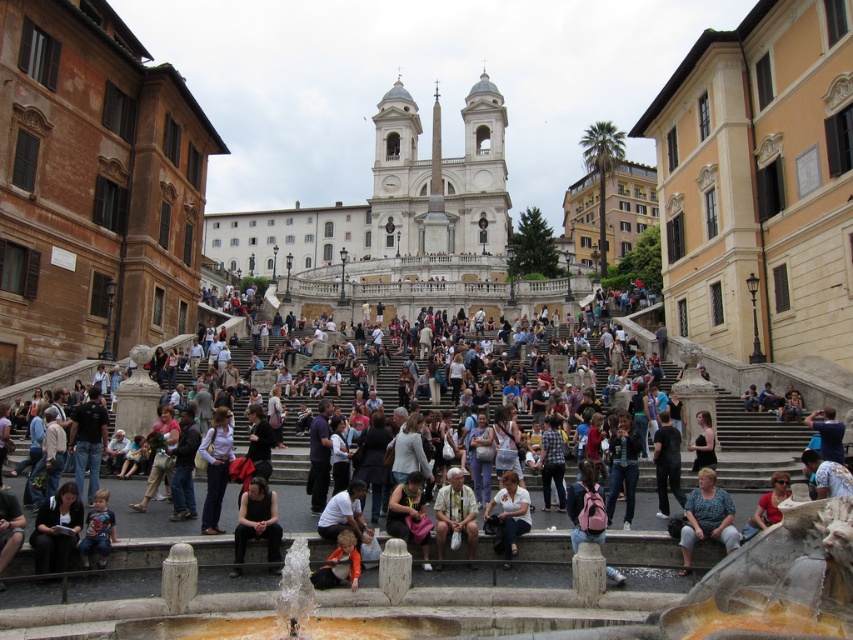
Question: Which point appears closest to the camera in this image?

Choices:
 (A) (519, 500)
 (B) (61, 508)

Answer: (B)

Question: Can you confirm if light blue denim jeans at center is positioned to the left of orange fabric child at center?

Choices:
 (A) yes
 (B) no

Answer: (A)

Question: Does blue fabric dress at center have a smaller size compared to light blue denim jeans at center?

Choices:
 (A) yes
 (B) no

Answer: (A)

Question: Which point appears farthest from the camera in this image?

Choices:
 (A) (453, 513)
 (B) (492, 506)
 (C) (698, 486)
 (D) (256, 484)

Answer: (C)

Question: Among these points, which one is farthest from the camera?

Choices:
 (A) (242, 506)
 (B) (341, 595)

Answer: (A)

Question: Is light beige fabric shirt at center above matte red shirt at lower right?

Choices:
 (A) yes
 (B) no

Answer: (B)